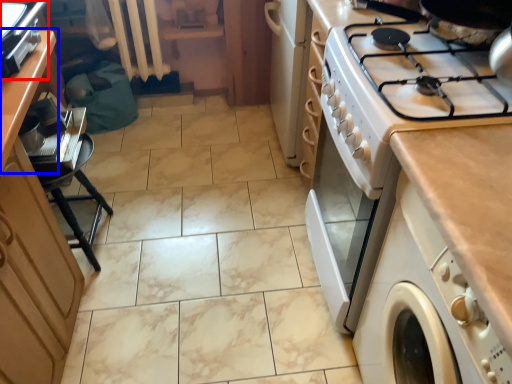
Question: Which point is closer to the camera, home appliance (highlighted by a red box) or counter (highlighted by a blue box)?

Choices:
 (A) home appliance
 (B) counter

Answer: (A)